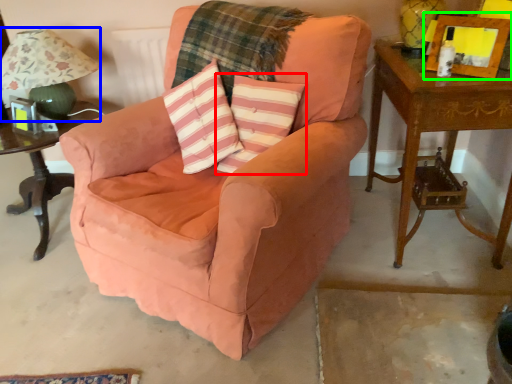
Question: Based on their relative distances, which object is farther from throw pillow (highlighted by a red box)? Choose from table lamp (highlighted by a blue box) and picture frame (highlighted by a green box).

Choices:
 (A) table lamp
 (B) picture frame

Answer: (A)